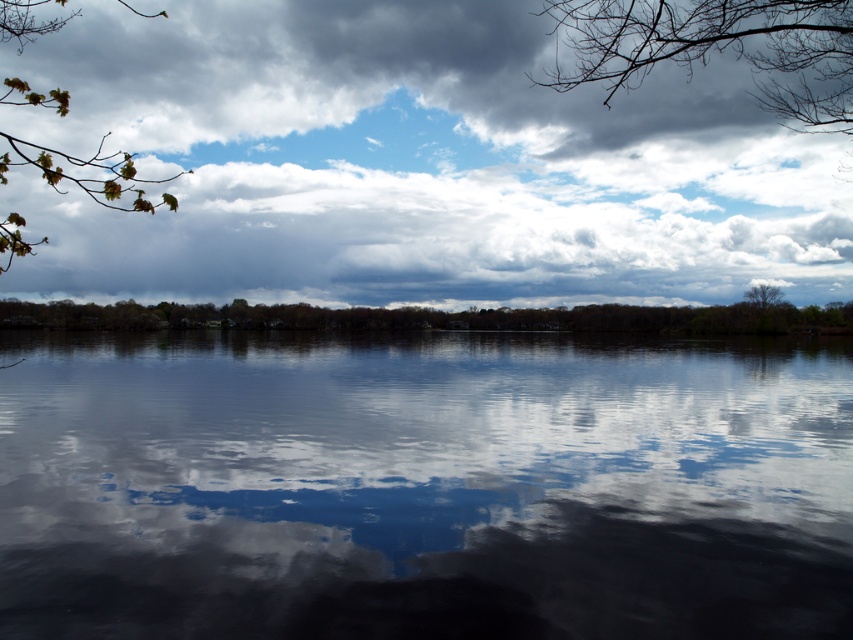
Question: Does cloudy sky at upper center appear on the left side of green matte tree at center?

Choices:
 (A) yes
 (B) no

Answer: (B)

Question: Considering the real-world distances, which object is closest to the smooth dark water at center?

Choices:
 (A) green leafy branch at upper left
 (B) bare branches at upper center
 (C) bare branches at upper right

Answer: (B)

Question: Which is nearer to the cloudy sky at upper center?

Choices:
 (A) bare branches at upper center
 (B) bare branches at upper right
 (C) green leafy branch at upper left
 (D) smooth dark water at center

Answer: (C)

Question: Among these objects, which one is nearest to the camera?

Choices:
 (A) smooth dark water at center
 (B) bare branches at upper center
 (C) green leafy branch at upper left

Answer: (A)

Question: Where is smooth dark water at center located in relation to green matte tree at center in the image?

Choices:
 (A) right
 (B) left

Answer: (A)

Question: Is smooth dark water at center bigger than bare branches at upper center?

Choices:
 (A) yes
 (B) no

Answer: (B)